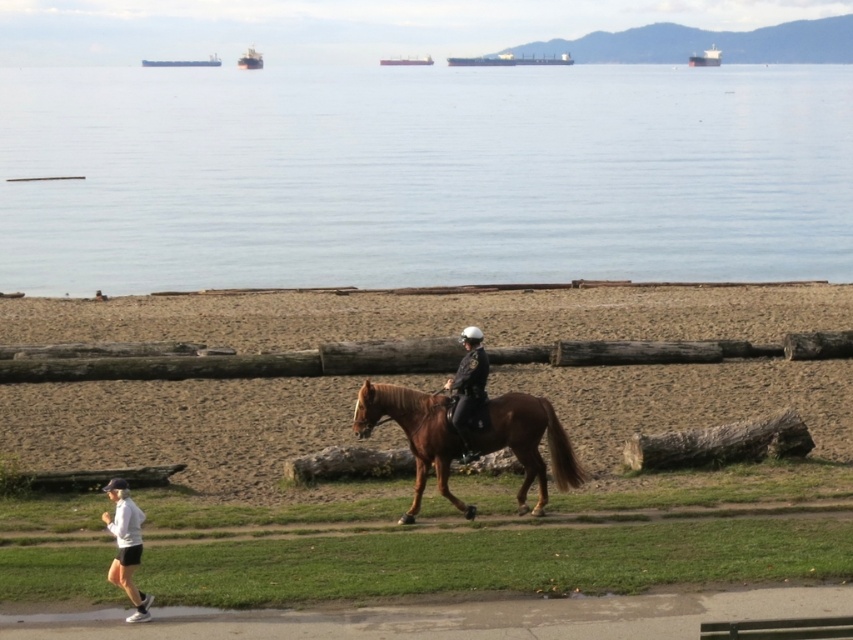
Question: Which point is farther from the camera taking this photo?

Choices:
 (A) [x=598, y=131]
 (B) [x=410, y=513]
 (C) [x=769, y=333]

Answer: (A)

Question: Can you confirm if clear water at upper center is wider than white matte jacket at lower left?

Choices:
 (A) no
 (B) yes

Answer: (B)

Question: Which object is positioned farthest from the shiny black helmet at center?

Choices:
 (A) clear water at upper center
 (B) brown sand at lower center

Answer: (A)

Question: Is brown glossy horse at center smaller than white matte jacket at lower left?

Choices:
 (A) no
 (B) yes

Answer: (A)

Question: Is clear water at upper center above white matte jacket at lower left?

Choices:
 (A) yes
 (B) no

Answer: (A)

Question: Which point appears farthest from the camera in this image?

Choices:
 (A) (479, 337)
 (B) (202, 460)

Answer: (B)